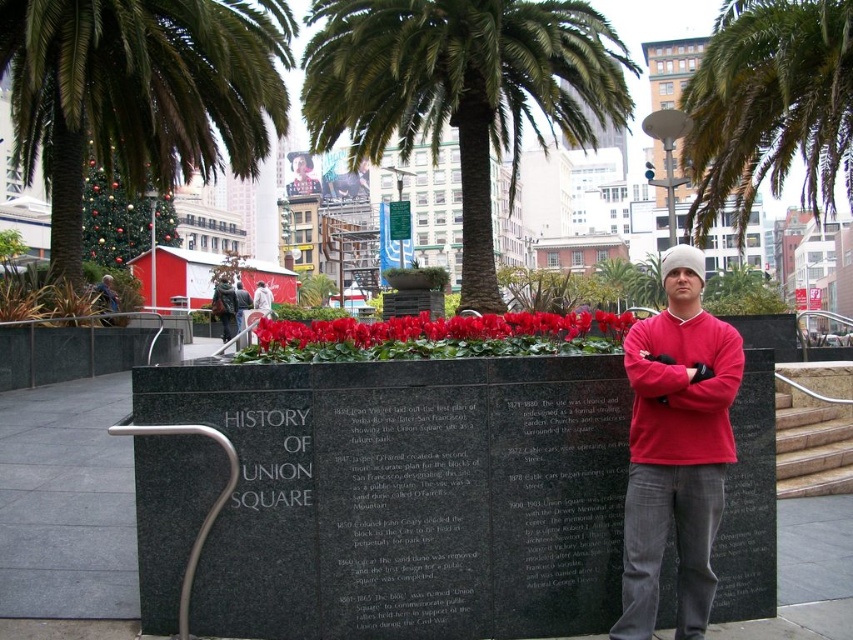
You are a photographer trying to capture both the green leafy palm tree at left and the red velvet flowers at center in a single shot. Based on their positions, which object will appear closer to the camera in the photo?

The green leafy palm tree at left will appear closer to the camera because the red velvet flowers at center is behind it.

You are standing in front of the monument at Union Square and want to take a photo. You notice two points marked on the ground at coordinates point (x=711, y=598) and point (x=726, y=12). Which point is closer to you?

Point (x=711, y=598) is closer to the viewer than point (x=726, y=12).

Consider the image. You are a photographer planning to take a picture of the green leafy palm tree at left and the red velvet flowers at center. Based on their positions, which object would appear closer to the camera in the final photo?

The green leafy palm tree at left appears closer to the camera in the final photo because it is positioned over the red velvet flowers at center, indicating it is in a forward layer.